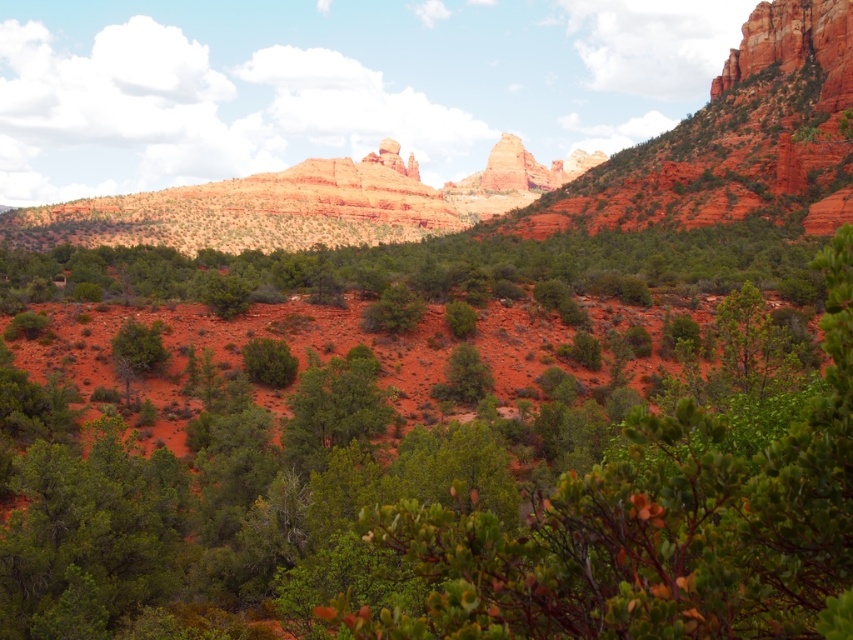
Between green leafy shrub at center and reddish-brown rock formation at center, which one has more height?

With more height is reddish-brown rock formation at center.

Can you confirm if green leafy shrub at center is bigger than reddish-brown rock formation at center?

No.

Where is `green leafy shrub at center`? This screenshot has height=640, width=853. green leafy shrub at center is located at coordinates (456, 502).